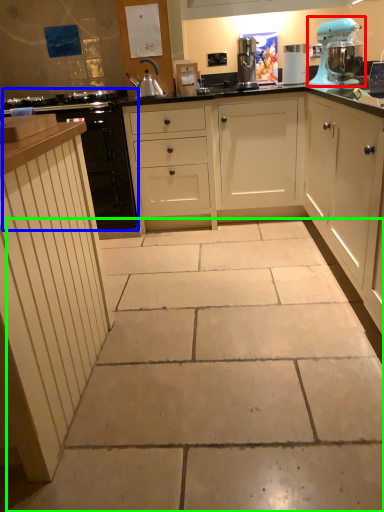
Question: Based on their relative distances, which object is farther from home appliance (highlighted by a red box)? Choose from cabinetry (highlighted by a blue box) and concrete (highlighted by a green box).

Choices:
 (A) cabinetry
 (B) concrete

Answer: (B)